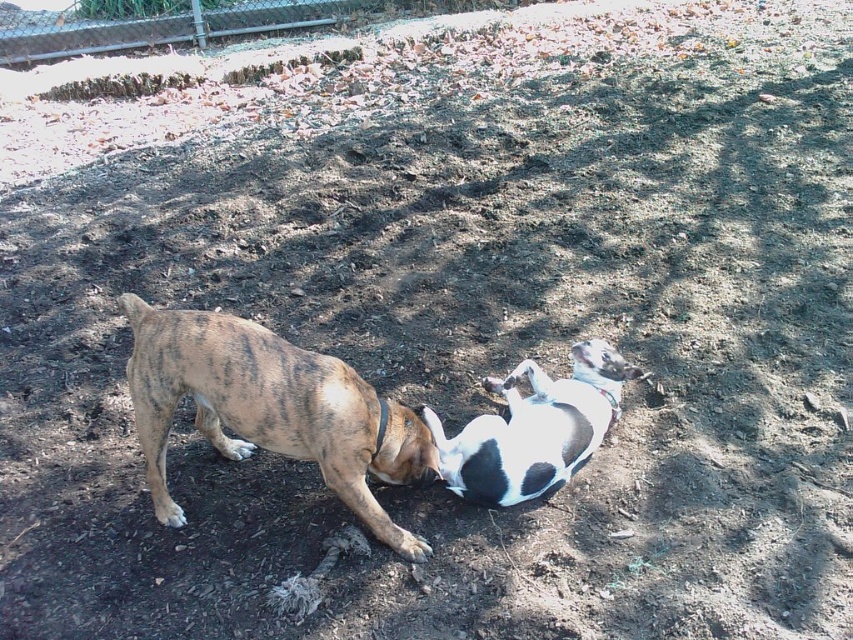
Question: Is brindle fur dog at center closer to the viewer compared to white-black fur dog at center?

Choices:
 (A) yes
 (B) no

Answer: (A)

Question: Is brindle fur dog at center above white-black fur dog at center?

Choices:
 (A) no
 (B) yes

Answer: (A)

Question: Does brindle fur dog at center come behind white-black fur dog at center?

Choices:
 (A) yes
 (B) no

Answer: (B)

Question: Which point is closer to the camera?

Choices:
 (A) (508, 444)
 (B) (151, 468)

Answer: (A)